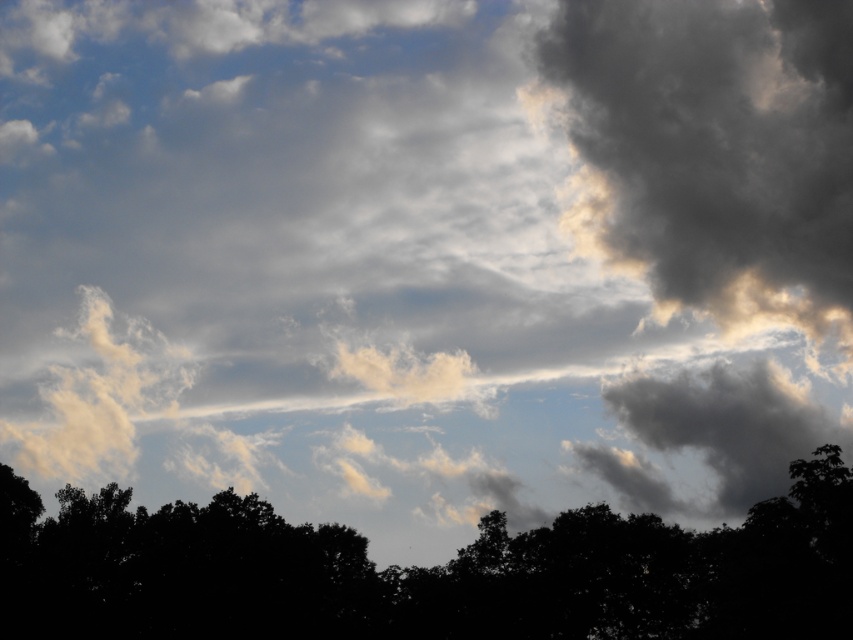
You are an artist trying to paint the scene. You want to ensure the black matte tree at bottom and the dark gray fluffy cloud at upper right are positioned correctly in terms of depth. Which object should you paint first to create the illusion of depth?

You should paint the dark gray fluffy cloud at upper right first because the black matte tree at bottom is closer to the viewer and needs to be placed over the cloud to create depth.

You are an artist trying to paint this scene. You want to ensure the black matte tree at bottom and dark gray fluffy cloud at upper right are proportionally accurate. Which object should you make wider in your painting?

The black matte tree at bottom should be made wider in the painting since its width surpasses that of the dark gray fluffy cloud at upper right.

You are a bird flying at an altitude of 100 feet. You see the black matte tree at bottom and the dark gray fluffy cloud at upper right. Can you fly between them without hitting either?

The black matte tree at bottom is 148.32 feet from the dark gray fluffy cloud at upper right. Since you are flying at 100 feet, which is below the cloud but above the tree, you can safely fly between them as the distance allows enough space.